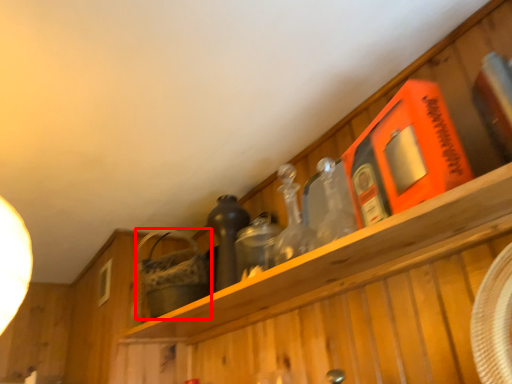
Question: From the image's perspective, what is the correct spatial relationship of basket (annotated by the red box) in relation to bottle?

Choices:
 (A) below
 (B) above

Answer: (A)